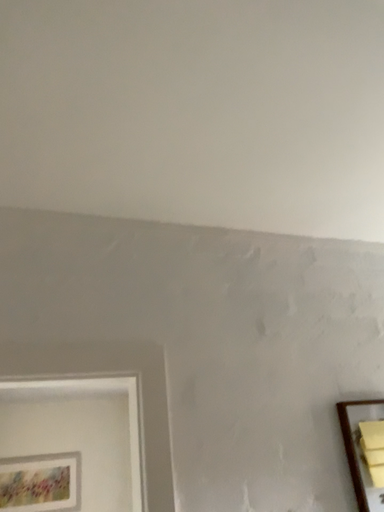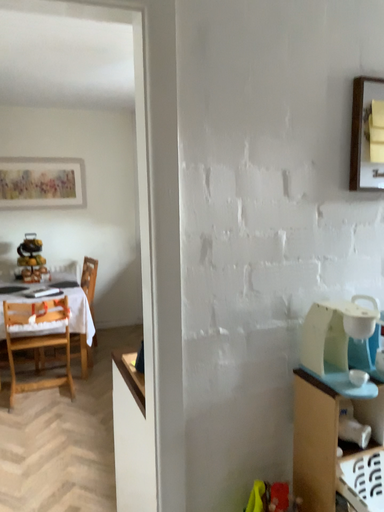
Question: How did the camera likely rotate when shooting the video?

Choices:
 (A) rotated downward
 (B) rotated upward

Answer: (A)